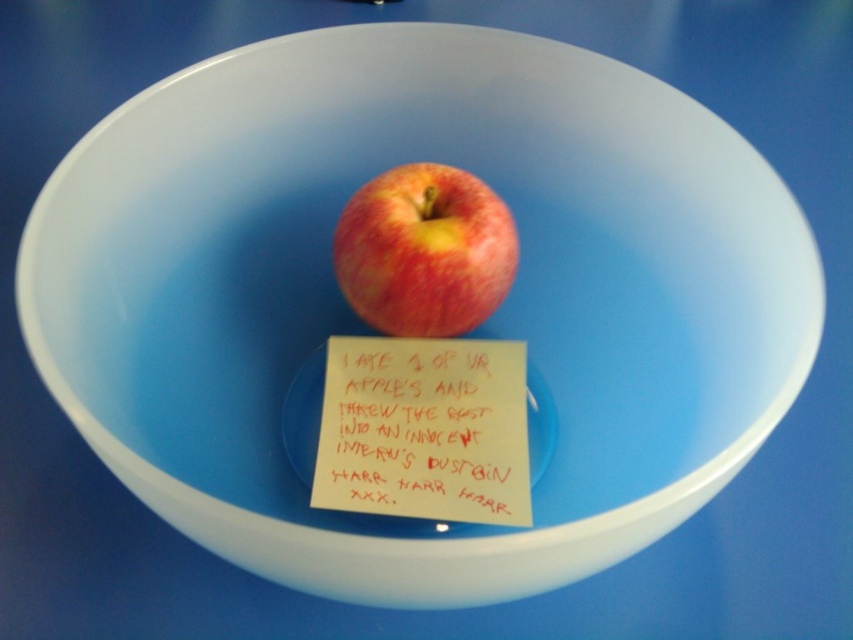
You are organizing a picnic basket and have both the white paper at center and the shiny red apple at center. If you need to place them side by side in a compartment that can only accommodate the wider object, which one should you prioritize packing first?

The white paper at center is wider than the shiny red apple at center, so you should prioritize packing the white paper at center first to ensure it fits in the compartment.